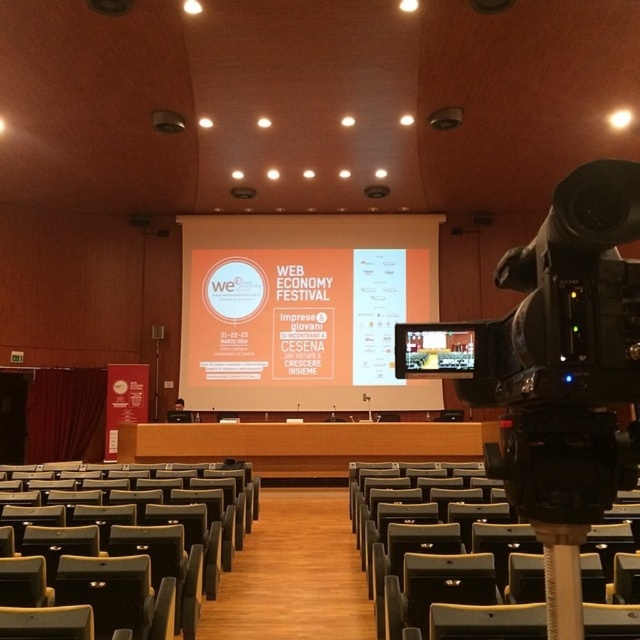
Is dark gray leather chair at center further to camera compared to matte white screen at center?

Yes, dark gray leather chair at center is further from the viewer.

Does dark gray leather chair at center have a lesser height compared to matte white screen at center?

No, dark gray leather chair at center is not shorter than matte white screen at center.

Locate an element on the screen. The height and width of the screenshot is (640, 640). dark gray leather chair at center is located at coordinates (x=122, y=541).

Who is positioned more to the left, matte gray chair at center or matte white screen at center?

From the viewer's perspective, matte white screen at center appears more on the left side.

Who is lower down, matte gray chair at center or matte white screen at center?

matte gray chair at center

Which is in front, point (472, 611) or point (452, 328)?

Positioned in front is point (452, 328).

At what (x,y) coordinates should I click in order to perform the action: click on matte gray chair at center. Please return your answer as a coordinate pair (x, y). This screenshot has width=640, height=640. Looking at the image, I should click on (444, 554).

Measure the distance between orange matte projection screen at center and camera.

The distance of orange matte projection screen at center from camera is 13.07 meters.

Who is more distant from viewer, (282, 264) or (449, 612)?

The point (282, 264) is more distant.

Does point (387, 225) come farther from viewer compared to point (589, 563)?

Yes, it is.

Where is `orange matte projection screen at center`? This screenshot has height=640, width=640. orange matte projection screen at center is located at coordinates (304, 310).